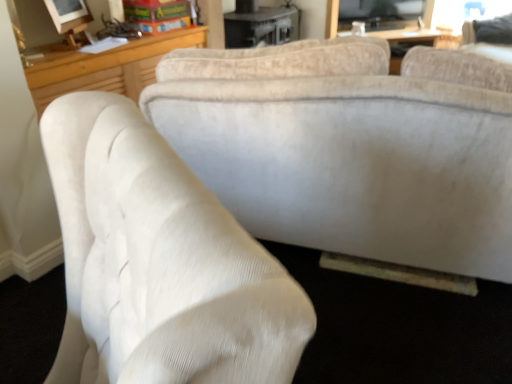
Describe the element at coordinates (159, 262) in the screenshot. This screenshot has height=384, width=512. I see `velvet white chair at center` at that location.

The image size is (512, 384). I want to click on velvet white chair at center, so click(x=159, y=262).

Where is `velvet white chair at center`? velvet white chair at center is located at coordinates (159, 262).